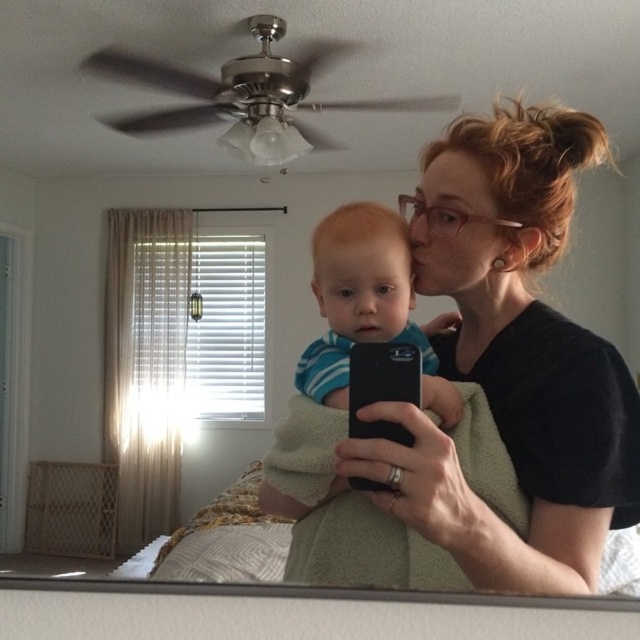
Question: Which point is farther from the camera taking this photo?

Choices:
 (A) (442, 236)
 (B) (422, 360)

Answer: (B)

Question: Among these objects, which one is farthest from the camera?

Choices:
 (A) smooth blue striped shirt at center
 (B) black matte shirt at center

Answer: (A)

Question: From the image, what is the correct spatial relationship of black matte shirt at center in relation to smooth blue striped shirt at center?

Choices:
 (A) left
 (B) right

Answer: (B)

Question: Can you confirm if smooth blue striped shirt at center is positioned below black matte smartphone at center?

Choices:
 (A) no
 (B) yes

Answer: (A)

Question: Which point is closer to the camera?

Choices:
 (A) black matte shirt at center
 (B) smooth blue striped shirt at center
 (C) black matte smartphone at center

Answer: (A)

Question: Does black matte shirt at center have a lesser width compared to smooth blue striped shirt at center?

Choices:
 (A) yes
 (B) no

Answer: (B)